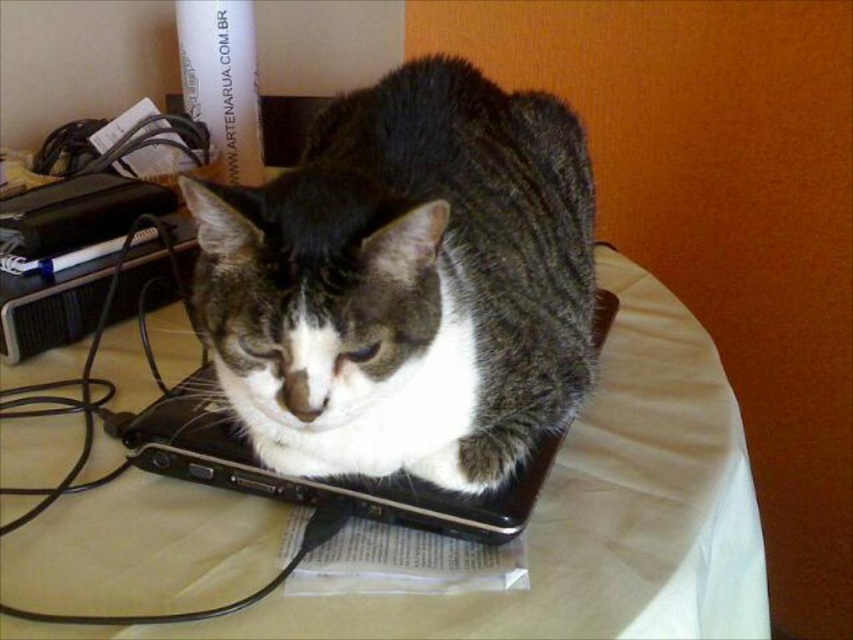
Question: Is gray tabby cat at center positioned behind black plastic laptop at center?

Choices:
 (A) no
 (B) yes

Answer: (A)

Question: Does beige fabric tablecloth at center come behind black plastic laptop at center?

Choices:
 (A) yes
 (B) no

Answer: (B)

Question: Considering the real-world distances, which object is farthest from the black plastic laptop at center?

Choices:
 (A) beige fabric tablecloth at center
 (B) gray tabby cat at center

Answer: (B)

Question: Which of the following is the farthest from the observer?

Choices:
 (A) (398, 68)
 (B) (486, 538)

Answer: (A)

Question: Which of the following is the closest to the observer?

Choices:
 (A) gray tabby cat at center
 (B) black plastic laptop at center

Answer: (A)

Question: Does beige fabric tablecloth at center appear over black plastic laptop at center?

Choices:
 (A) yes
 (B) no

Answer: (B)